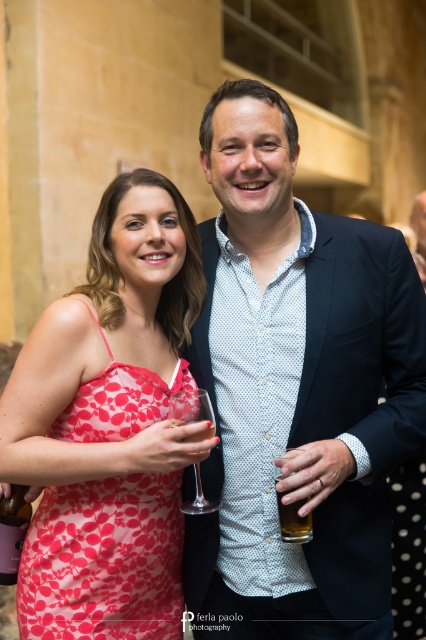
You are a photographer adjusting your camera settings to capture the scene. You notice two glasses on the table between the subjects. The clear glass wine at lower left and the translucent glass beer at center. Which glass is closer to you?

The clear glass wine at lower left is closer to you because it is further to the viewer than the translucent glass beer at center.

You are a photographer at the event and want to adjust the lighting so that both the matte blue shirt at center and the floral print fabric dress at left are equally illuminated. Which object should you move closer to the light source?

The floral print fabric dress at left should be moved closer to the light source because the matte blue shirt at center is positioned on the right side of it, meaning the dress is farther from the light source.

You are a bartender at the event and need to serve drinks to guests. You have a clear glass wine at lower left and a translucent glass beer at center. Which glass is more suitable for serving a wine drink?

The clear glass wine at lower left is more suitable for serving a wine drink because it is much taller than the translucent glass beer at center, which is better suited for beer.